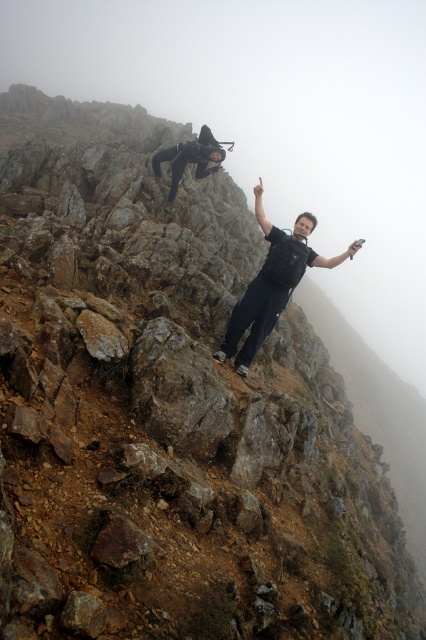
Does black matte pants at center have a greater width compared to black matte wetsuit at upper center?

Correct, the width of black matte pants at center exceeds that of black matte wetsuit at upper center.

Where is `black matte pants at center`? black matte pants at center is located at coordinates (271, 284).

Does point (273, 280) come behind point (190, 147)?

That is False.

The height and width of the screenshot is (640, 426). Find the location of `black matte pants at center`. black matte pants at center is located at coordinates (271, 284).